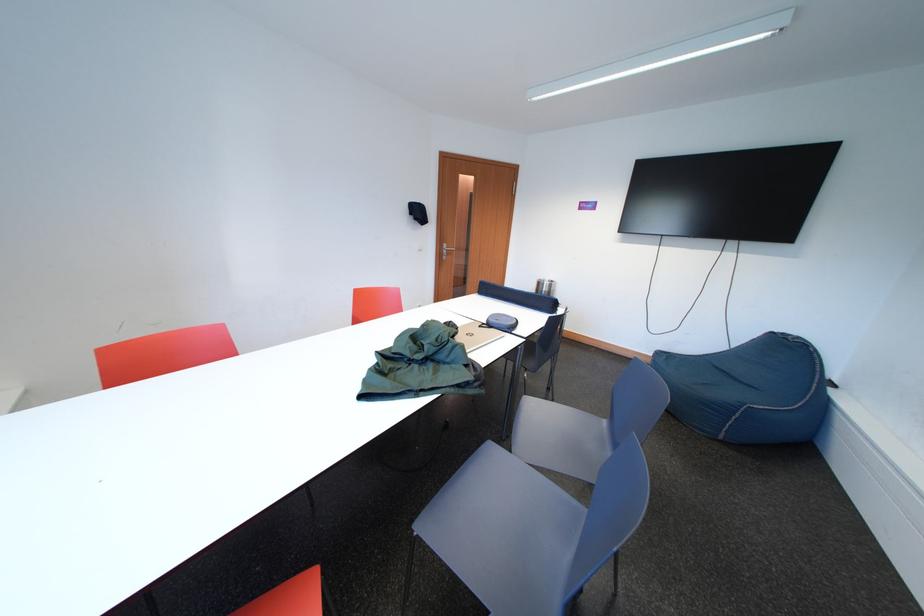
What do you see at coordinates (503, 533) in the screenshot? I see `the chair sitting surface` at bounding box center [503, 533].